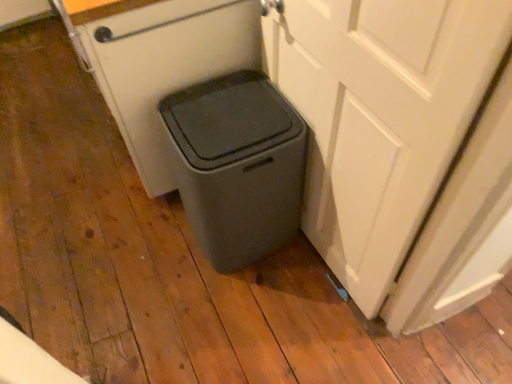
The image size is (512, 384). I want to click on free space in front of matte gray trash can at lower center, so click(220, 315).